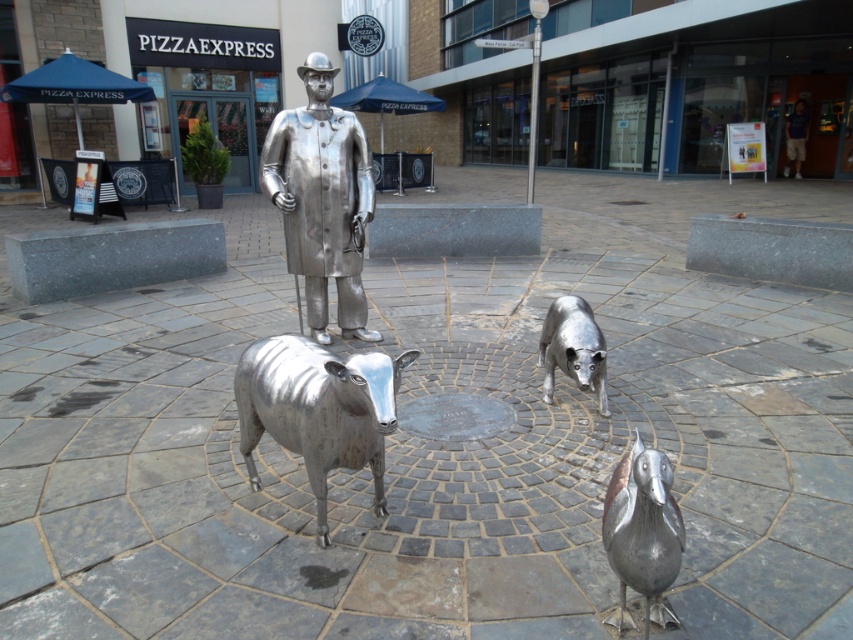
You are a visitor at the Pizza Express restaurant and see the brushed metal sheep at center and the brushed metal dog at center in the plaza. Which sculpture is positioned lower in the scene?

The brushed metal sheep at center is positioned lower than the brushed metal dog at center.

You are standing in front of the Pizza Express restaurant and see the brushed metal sheep at center. If you want to take a photo of it from a distance of exactly 6.63 feet, where should you stand?

The brushed metal sheep at center is 6.63 feet away from the camera, so you should stand exactly where the camera is positioned to take the photo from that distance.

You are a delivery person with a cart that is 4 feet wide. You need to move your cart from the Pizza Express restaurant entrance to the area between the brushed metal sheep at center and the brushed metal duck at lower right. Can your cart fit through the space between them?

The distance between the brushed metal sheep at center and the brushed metal duck at lower right is 3.49 feet. Since your cart is 4 feet wide, it cannot fit through the space between them as the available space is narrower than the cart.